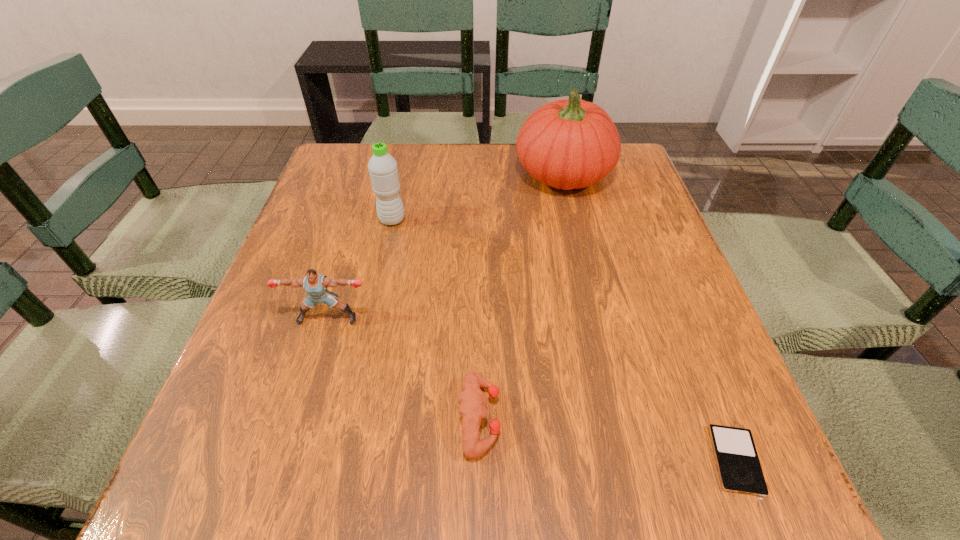
Find the location of a particular element. free space located on the front-facing side of the taller puncher is located at coordinates (284, 460).

Image resolution: width=960 pixels, height=540 pixels. I want to click on free spot located with the gloves of the right puncher facing forward, so click(740, 418).

Locate an element on the screen. Image resolution: width=960 pixels, height=540 pixels. vacant space located 0.120m on the back of the shortest object is located at coordinates (696, 361).

Locate an element on the screen. The height and width of the screenshot is (540, 960). object located at the far edge is located at coordinates (568, 144).

The height and width of the screenshot is (540, 960). Identify the location of puncher present at the near edge. (472, 400).

Where is `iPod that is at the near edge`? iPod that is at the near edge is located at coordinates (739, 468).

Identify the location of object that is positioned at the left edge. The image size is (960, 540). (315, 284).

What are the coordinates of `pumpkin present at the right edge` in the screenshot? It's located at (568, 144).

Where is `iPod positioned at the right edge`? Image resolution: width=960 pixels, height=540 pixels. iPod positioned at the right edge is located at coordinates (739, 468).

The height and width of the screenshot is (540, 960). Find the location of `object located at the far right corner`. object located at the far right corner is located at coordinates (568, 144).